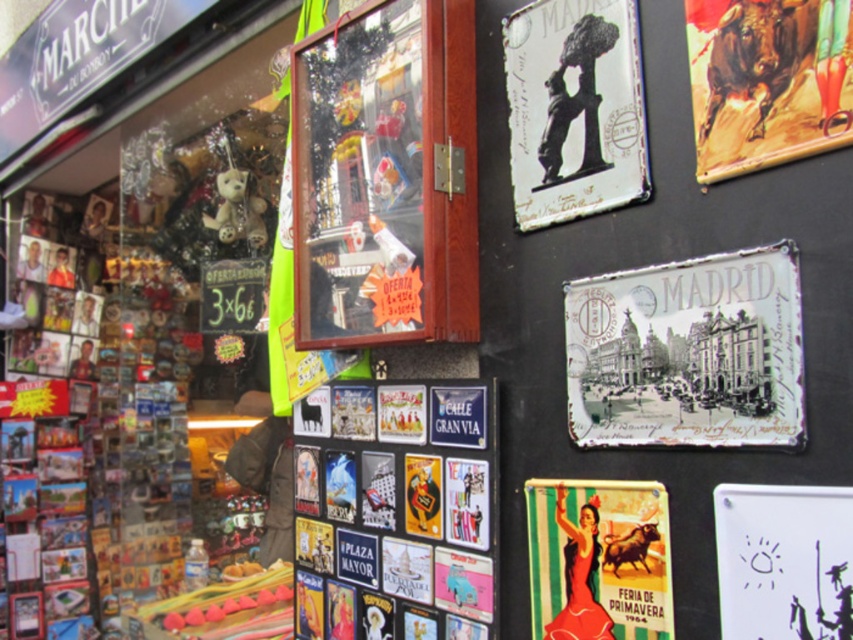
Question: Is metallic glass display at center above metallic green and white poster at upper right?

Choices:
 (A) no
 (B) yes

Answer: (B)

Question: Which point is farther from the camera taking this photo?

Choices:
 (A) (614, 522)
 (B) (265, 236)

Answer: (B)

Question: Can you confirm if metallic bull at upper right is positioned above fuzzy white teddy bear at left?

Choices:
 (A) yes
 (B) no

Answer: (B)

Question: Is metallic bull at upper right to the right of fuzzy white teddy bear at left from the viewer's perspective?

Choices:
 (A) yes
 (B) no

Answer: (A)

Question: Based on their relative distances, which object is nearer to the metallic statue at upper center?

Choices:
 (A) fuzzy white teddy bear at left
 (B) metallic glass display at center
 (C) metallic bull at upper right
 (D) white metal madrid sign at upper right

Answer: (C)

Question: Which point is farther to the camera?

Choices:
 (A) (596, 627)
 (B) (572, 353)
 (C) (538, 116)

Answer: (C)